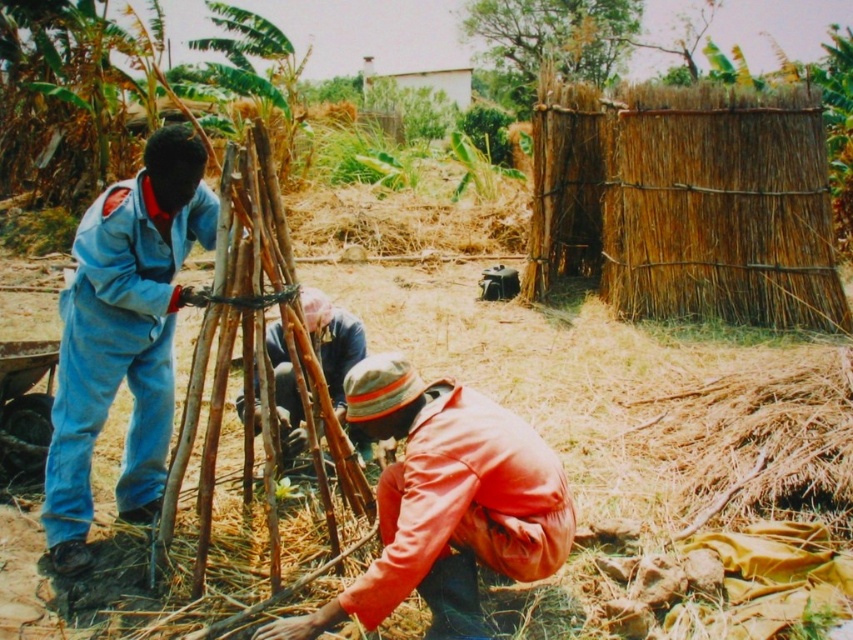
You are a worker in the field and need to locate the blue denim jumpsuit at left. Where should you look in relation to the brown fabric at center?

The blue denim jumpsuit at left is located above the brown fabric at center, so you should look upwards towards the left side relative to the brown fabric at center.

You are a worker in the field and need to determine which object is wider. You see the blue denim jumpsuit at left and the orange fabric at lower center. Which one has a greater width?

The orange fabric at lower center has a greater width than the blue denim jumpsuit at left.

You are a worker in the scene and need to determine which fabric is taller. You see the orange fabric at lower center and the brown fabric at center. Which one is taller?

The orange fabric at lower center is taller than the brown fabric at center.